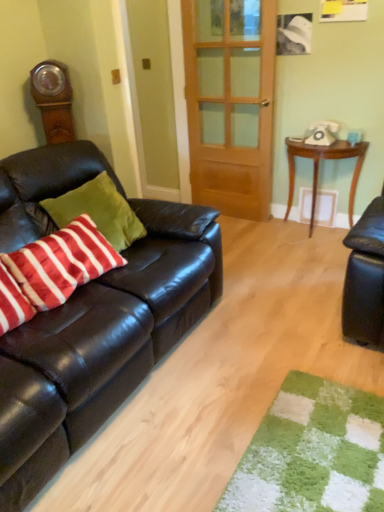
This screenshot has height=512, width=384. In order to click on vacant area situated below wooden table at right (from a real-world perspective) in this screenshot , I will do `click(312, 236)`.